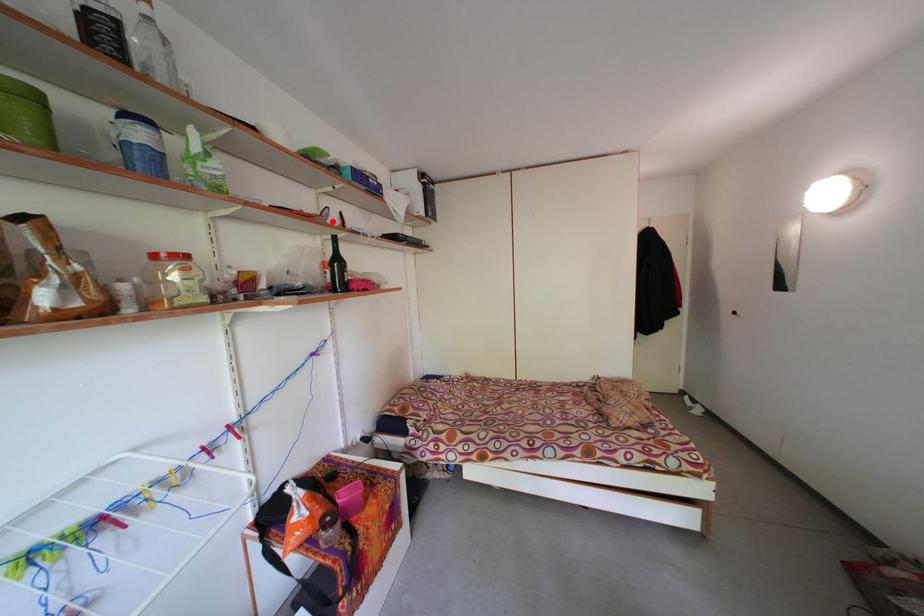
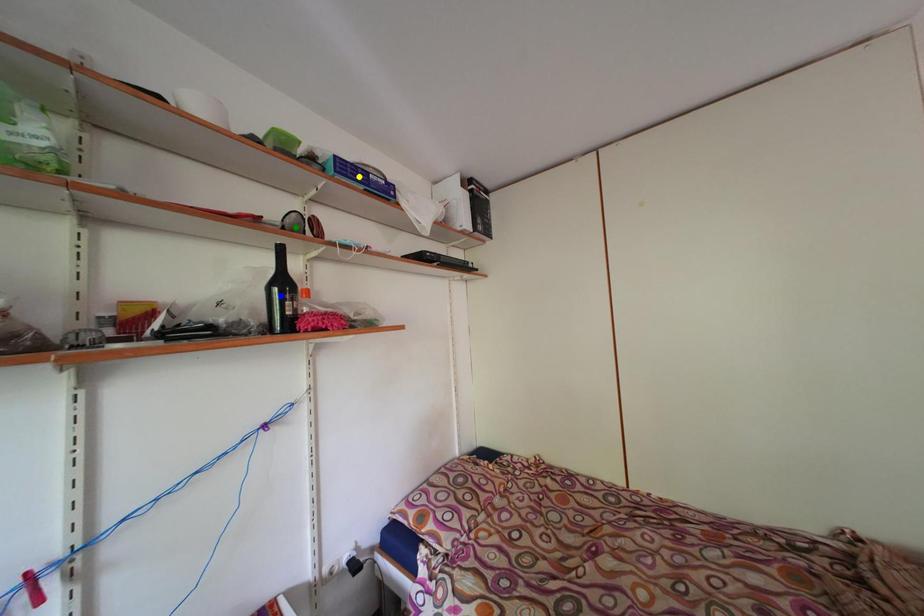
Question: I am providing you with two images of the same scene from different viewpoints. A red point is marked on the first image. You are given multiple points on the second image. Which spot in image 2 lines up with the point in image 1?

Choices:
 (A) blue point
 (B) yellow point
 (C) green point

Answer: (C)